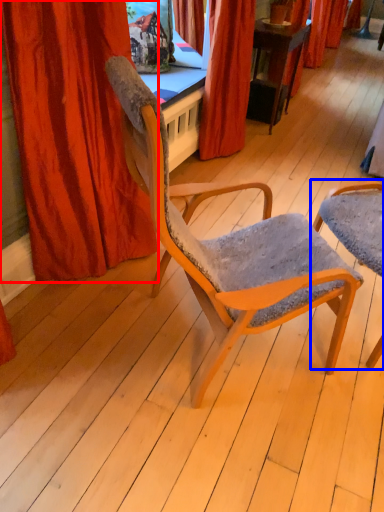
Question: Which object appears farthest to the camera in this image, curtain (highlighted by a red box) or chair (highlighted by a blue box)?

Choices:
 (A) curtain
 (B) chair

Answer: (B)